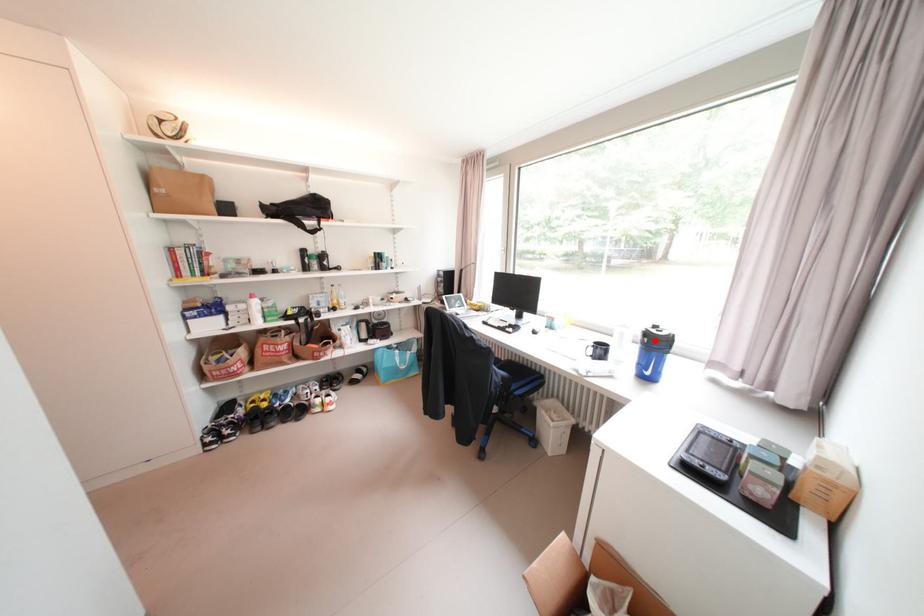
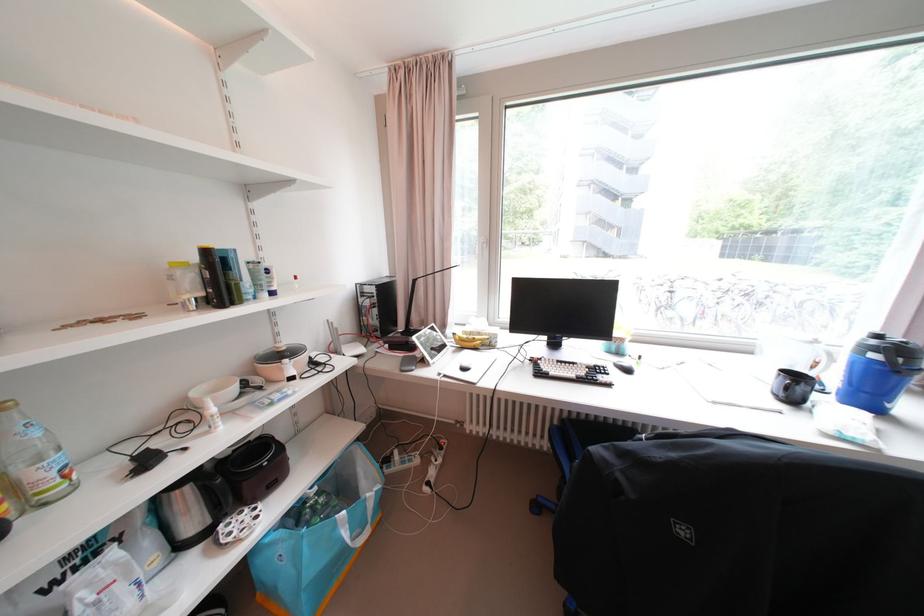
Question: I am providing you with two images of the same scene from different viewpoints. Given a red point in image1, look at the same physical point in image2. Is it:

Choices:
 (A) Closer to the viewpoint
 (B) Farther from the viewpoint

Answer: (A)